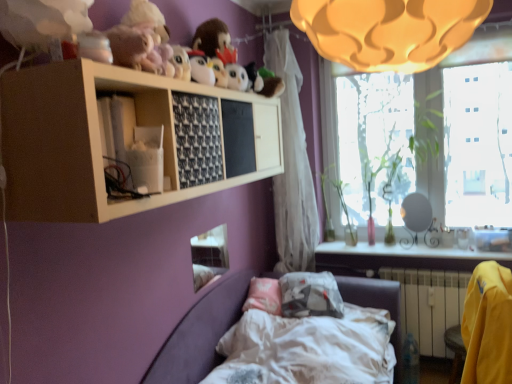
Question: Considering the relative sizes of velvet purple bed at lower center and yellow fabric chair at lower right in the image provided, is velvet purple bed at lower center wider than yellow fabric chair at lower right?

Choices:
 (A) yes
 (B) no

Answer: (A)

Question: Is velvet purple bed at lower center positioned beyond the bounds of yellow fabric chair at lower right?

Choices:
 (A) no
 (B) yes

Answer: (B)

Question: Is velvet purple bed at lower center placed right next to yellow fabric chair at lower right?

Choices:
 (A) no
 (B) yes

Answer: (A)

Question: Could yellow fabric chair at lower right be considered to be inside velvet purple bed at lower center?

Choices:
 (A) yes
 (B) no

Answer: (B)

Question: Is velvet purple bed at lower center taller than yellow fabric chair at lower right?

Choices:
 (A) no
 (B) yes

Answer: (A)

Question: Can you confirm if velvet purple bed at lower center is positioned to the left of yellow fabric chair at lower right?

Choices:
 (A) yes
 (B) no

Answer: (A)

Question: Is translucent glass window at upper right further to camera compared to yellow fabric armchair at lower right?

Choices:
 (A) yes
 (B) no

Answer: (A)

Question: Is translucent glass window at upper right positioned with its back to yellow fabric armchair at lower right?

Choices:
 (A) no
 (B) yes

Answer: (A)

Question: From the image's perspective, is translucent glass window at upper right located beneath yellow fabric armchair at lower right?

Choices:
 (A) no
 (B) yes

Answer: (A)

Question: Does translucent glass window at upper right have a larger size compared to yellow fabric armchair at lower right?

Choices:
 (A) no
 (B) yes

Answer: (A)

Question: Is translucent glass window at upper right not near yellow fabric armchair at lower right?

Choices:
 (A) no
 (B) yes

Answer: (B)

Question: Would you say translucent glass window at upper right contains yellow fabric armchair at lower right?

Choices:
 (A) no
 (B) yes

Answer: (A)

Question: Is matte yellow lampshade at upper center at the left side of yellow fabric chair at lower right?

Choices:
 (A) yes
 (B) no

Answer: (A)